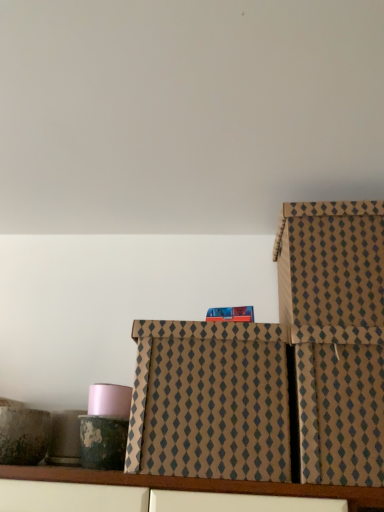
Question: Considering the positions of brown textured box at right, the 2th box positioned from the left, and brown textured box at center, which ranks as the second box in right-to-left order, in the image, is brown textured box at right, the 2th box positioned from the left, taller or shorter than brown textured box at center, which ranks as the second box in right-to-left order,?

Choices:
 (A) tall
 (B) short

Answer: (B)

Question: Considering their positions, is brown textured box at right, the 2th box positioned from the left, located in front of or behind brown textured box at center, the first box positioned from the left?

Choices:
 (A) front
 (B) behind

Answer: (A)

Question: Considering the positions of point (372, 424) and point (198, 337), is point (372, 424) closer or farther from the camera than point (198, 337)?

Choices:
 (A) farther
 (B) closer

Answer: (B)

Question: Is brown textured box at center, which ranks as the second box in right-to-left order, inside or outside of brown textured box at right, the 2th box positioned from the left?

Choices:
 (A) inside
 (B) outside

Answer: (B)

Question: Based on their sizes in the image, would you say brown textured box at center, which ranks as the second box in right-to-left order, is bigger or smaller than brown textured box at right, the 2th box positioned from the left?

Choices:
 (A) small
 (B) big

Answer: (B)

Question: From the image's perspective, relative to brown textured box at right, the first box positioned from the right, is brown textured box at center, the first box positioned from the left, above or below?

Choices:
 (A) above
 (B) below

Answer: (A)

Question: Based on their positions, is brown textured box at center, the first box positioned from the left, located to the left or right of brown textured box at right, the 2th box positioned from the left?

Choices:
 (A) left
 (B) right

Answer: (A)